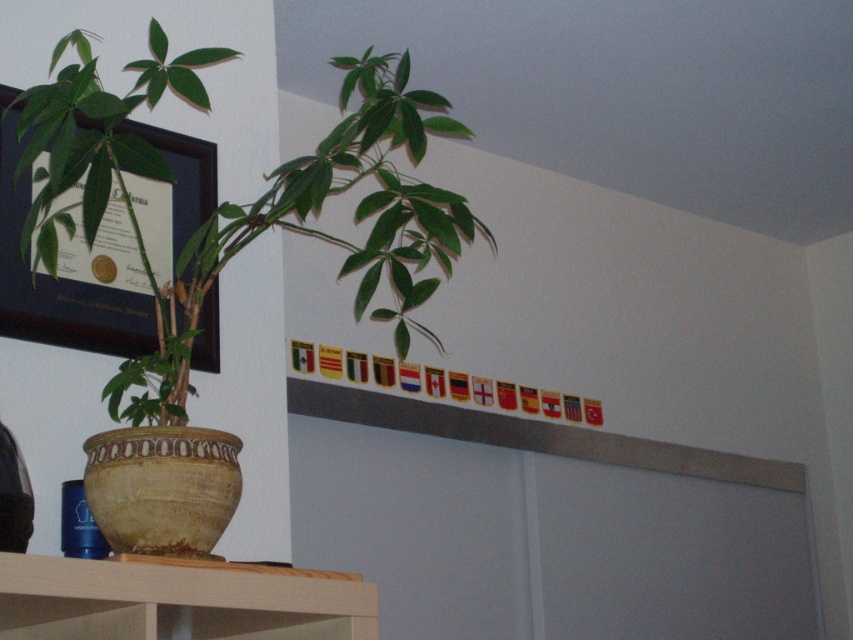
Is point (68, 138) positioned in front of point (105, 321)?

Yes, point (68, 138) is closer to viewer.

Find the location of a particular element. The height and width of the screenshot is (640, 853). green matte plant at left is located at coordinates (247, 204).

Between point (134, 384) and point (21, 291), which one is positioned in front?

Point (134, 384) is more forward.

The width and height of the screenshot is (853, 640). What are the coordinates of `green matte plant at left` in the screenshot? It's located at (247, 204).

Between wooden at lower left and matte black frame at upper left, which one appears on the right side from the viewer's perspective?

From the viewer's perspective, wooden at lower left appears more on the right side.

Measure the distance between wooden at lower left and camera.

wooden at lower left and camera are 1.19 meters apart.

Is point (349, 612) farther from viewer compared to point (155, 129)?

That is False.

Where is `wooden at lower left`? The height and width of the screenshot is (640, 853). wooden at lower left is located at coordinates (175, 602).

Can you confirm if green matte plant at left is shorter than wooden at lower left?

No, green matte plant at left is not shorter than wooden at lower left.

Between point (19, 115) and point (57, 614), which one is positioned in front?

Point (57, 614) is in front.

Which is behind, point (126, 404) or point (149, 600)?

The point (126, 404) is behind.

Where is `green matte plant at left`? This screenshot has height=640, width=853. green matte plant at left is located at coordinates (247, 204).